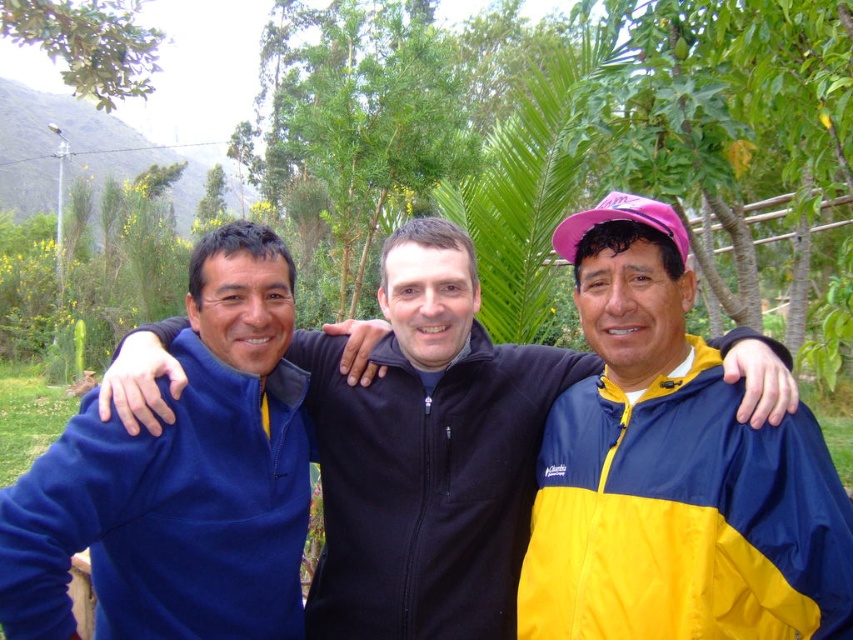
Question: Which point is closer to the camera?

Choices:
 (A) blue fleece jacket at left
 (B) blue fleece jacket at center
 (C) yellowshiny fabricjacket at right

Answer: (C)

Question: Does blue fleece jacket at center have a lesser width compared to blue fleece jacket at left?

Choices:
 (A) yes
 (B) no

Answer: (B)

Question: Which of the following is the farthest from the observer?

Choices:
 (A) blue fleece jacket at center
 (B) blue fleece jacket at left
 (C) yellowshiny fabricjacket at right

Answer: (A)

Question: Can you confirm if yellowshiny fabricjacket at right is smaller than blue fleece jacket at left?

Choices:
 (A) no
 (B) yes

Answer: (B)

Question: Can you confirm if yellowshiny fabricjacket at right is positioned to the right of blue fleece jacket at left?

Choices:
 (A) yes
 (B) no

Answer: (A)

Question: Which object is farther from the camera taking this photo?

Choices:
 (A) blue fleece jacket at left
 (B) yellowshiny fabricjacket at right

Answer: (A)